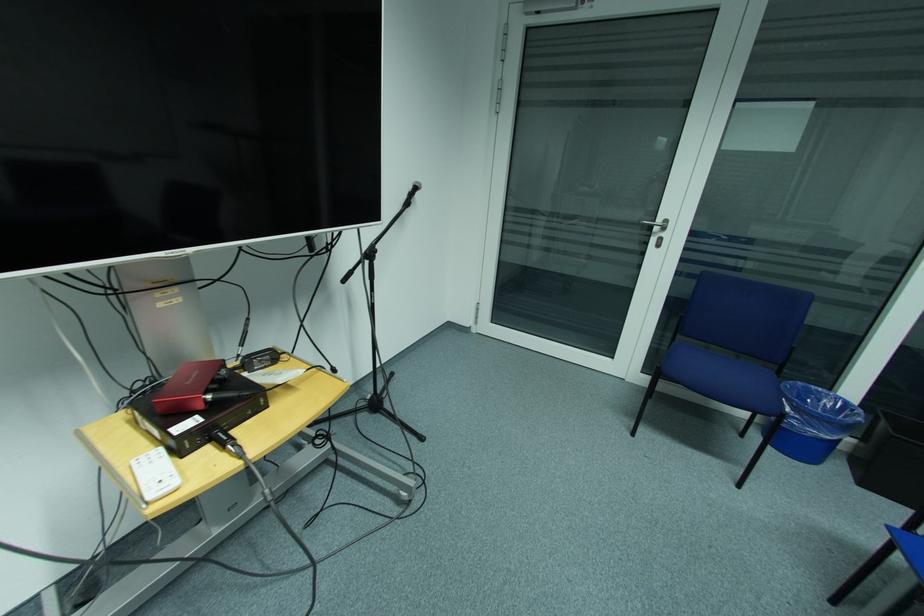
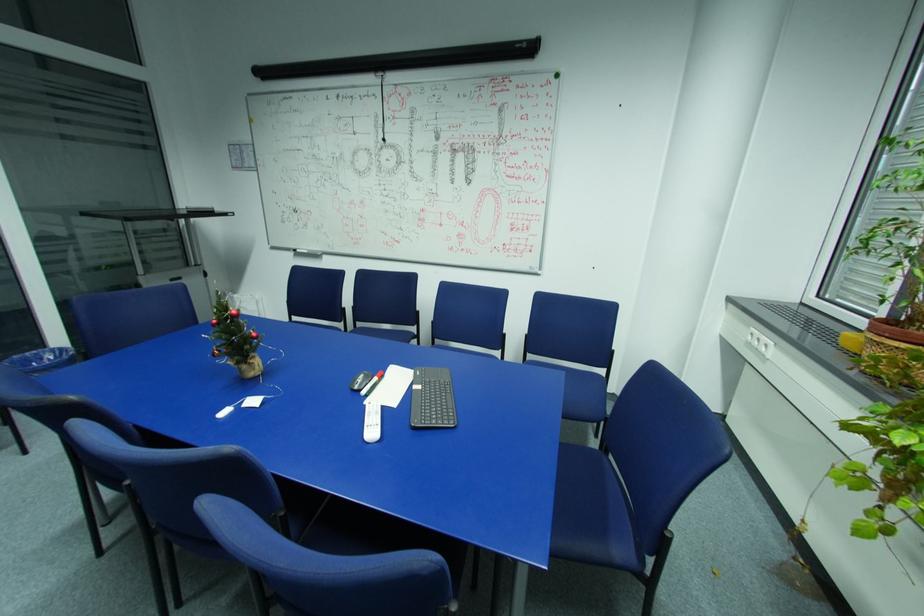
The images are taken continuously from a first-person perspective. In which direction is your viewpoint rotating?

The camera rotated toward right-down.